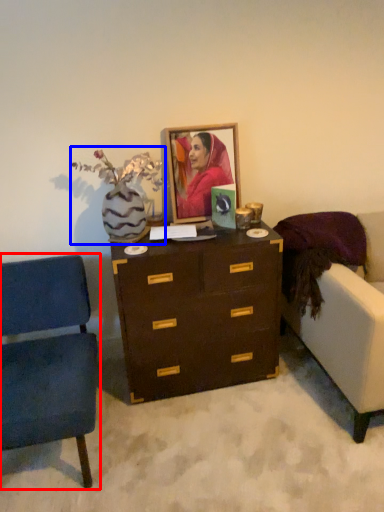
Question: Which object is closer to the camera taking this photo, chair (highlighted by a red box) or floral arrangement (highlighted by a blue box)?

Choices:
 (A) chair
 (B) floral arrangement

Answer: (A)